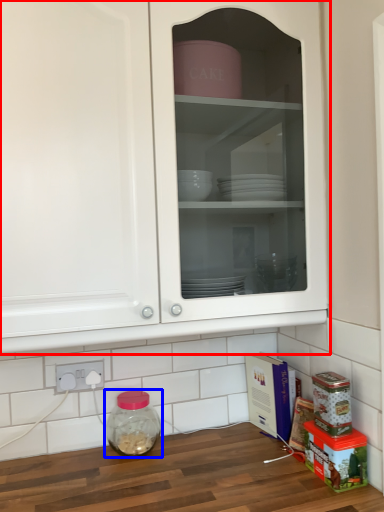
Question: Which object appears farthest to the camera in this image, cabinetry (highlighted by a red box) or glass jar (highlighted by a blue box)?

Choices:
 (A) cabinetry
 (B) glass jar

Answer: (B)